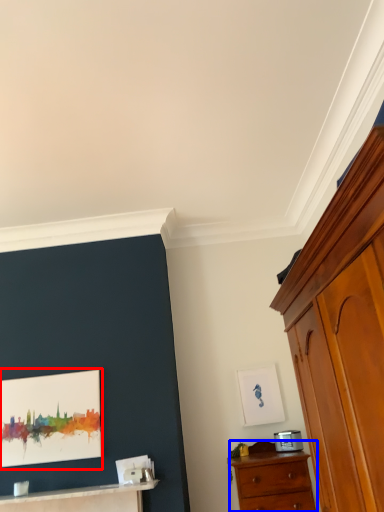
Question: Which object appears farthest to the camera in this image, picture frame (highlighted by a red box) or chest of drawers (highlighted by a blue box)?

Choices:
 (A) picture frame
 (B) chest of drawers

Answer: (A)